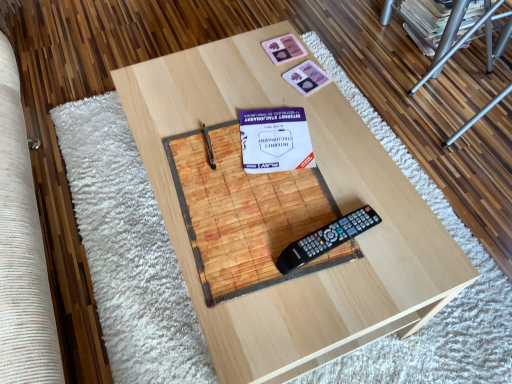
Where is `empty space that is in between black plastic remote control at center and white paper at center`? empty space that is in between black plastic remote control at center and white paper at center is located at coordinates (306, 193).